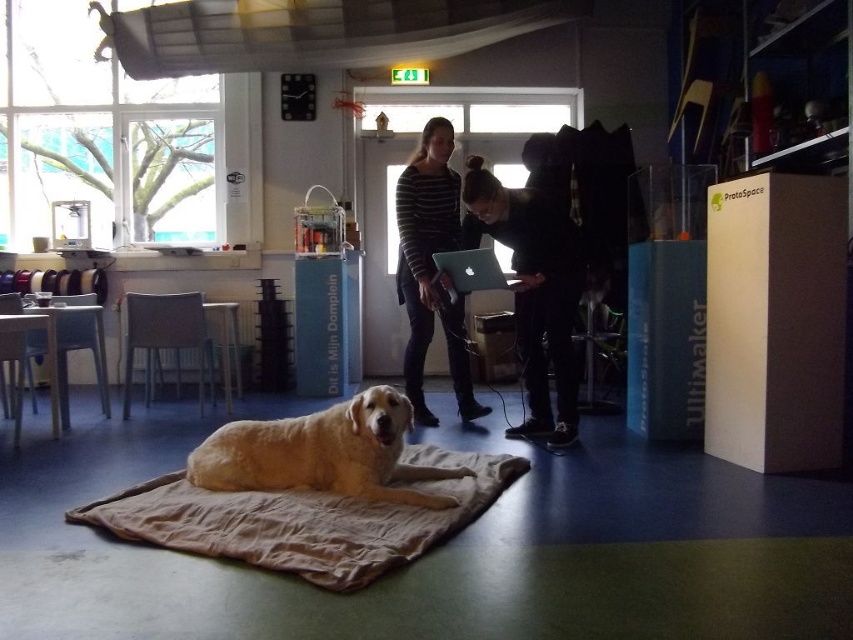
The height and width of the screenshot is (640, 853). What do you see at coordinates (305, 518) in the screenshot?
I see `beige fabric mat at lower center` at bounding box center [305, 518].

Based on the photo, who is more distant from viewer, [234,531] or [474,403]?

The point [474,403] is behind.

The image size is (853, 640). Identify the location of beige fabric mat at lower center. (305, 518).

Can you confirm if golden fur dog at center is shorter than black fabric jacket at center?

Correct, golden fur dog at center is not as tall as black fabric jacket at center.

Who is taller, golden fur dog at center or black fabric jacket at center?

black fabric jacket at center is taller.

Which is behind, point (375, 432) or point (469, 180)?

The point (469, 180) is behind.

Identify the location of golden fur dog at center. (322, 452).

Between beige fabric mat at lower center and silver metallic laptop at center, which one appears on the left side from the viewer's perspective?

beige fabric mat at lower center

Describe the element at coordinates (305, 518) in the screenshot. This screenshot has width=853, height=640. I see `beige fabric mat at lower center` at that location.

Identify the location of beige fabric mat at lower center. The width and height of the screenshot is (853, 640). [305, 518].